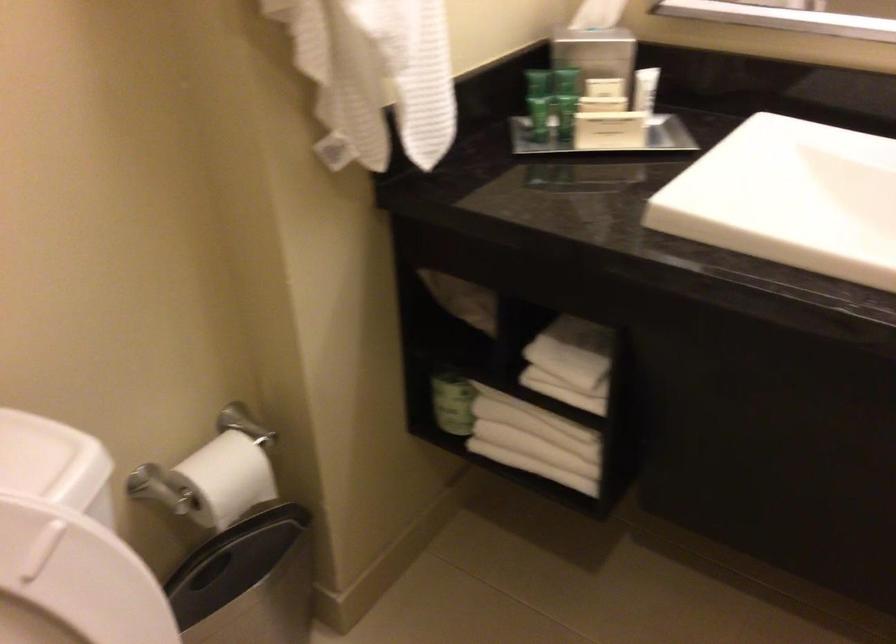
Identify the location of black trash can lid. This screenshot has height=644, width=896. (247, 582).